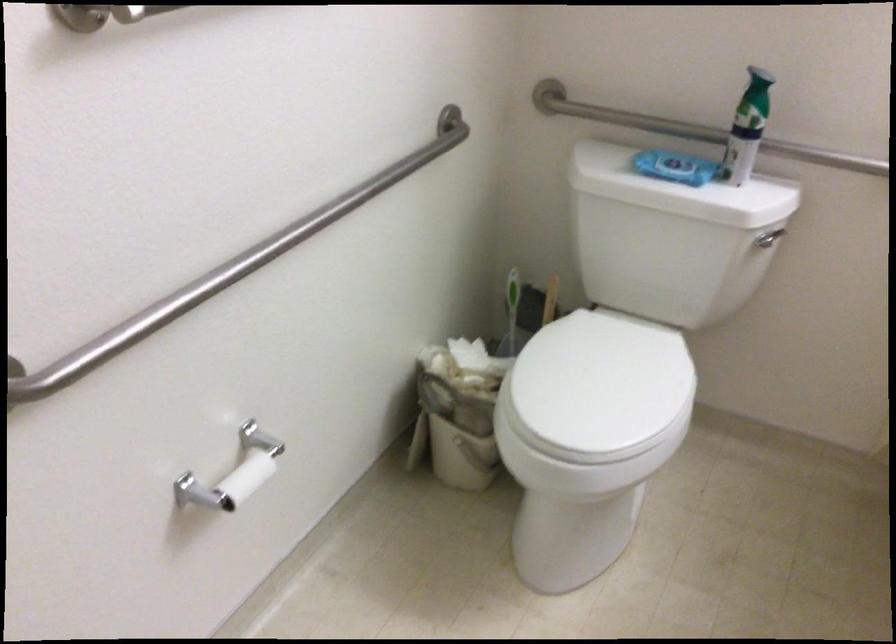
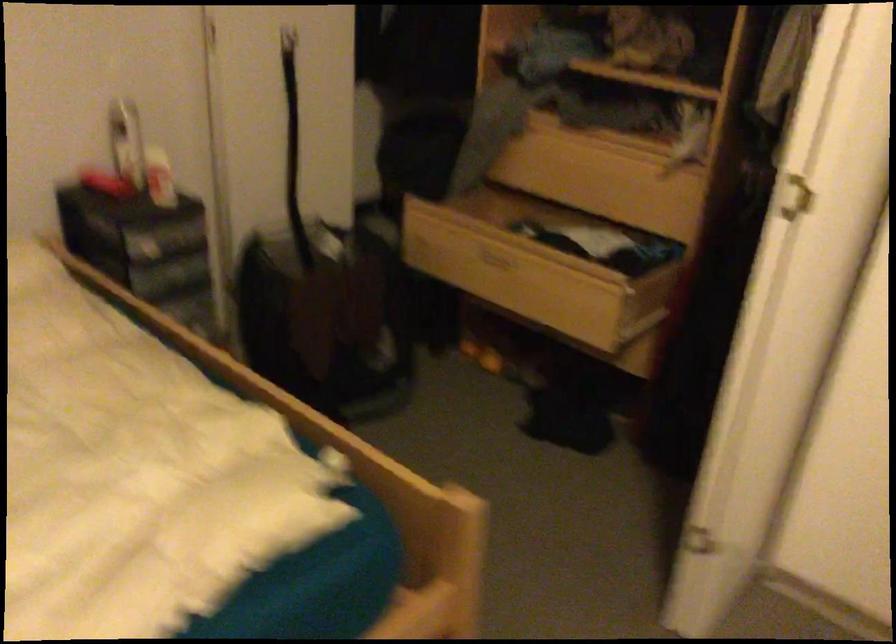
Question: I am providing you with two images of the same scene from different viewpoints. After the viewpoint changes to image2, which objects are now occluded?

Choices:
 (A) white textured pillow
 (B) open wooden drawer
 (C) metal grab bar
 (D) white door handle

Answer: (C)